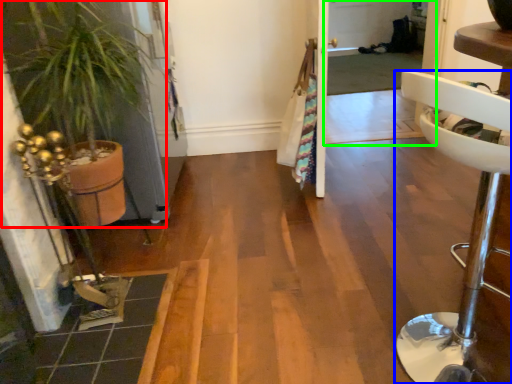
Question: Estimate the real-world distances between objects in this image. Which object is closer to houseplant (highlighted by a red box), furniture (highlighted by a blue box) or screen door (highlighted by a green box)?

Choices:
 (A) furniture
 (B) screen door

Answer: (A)